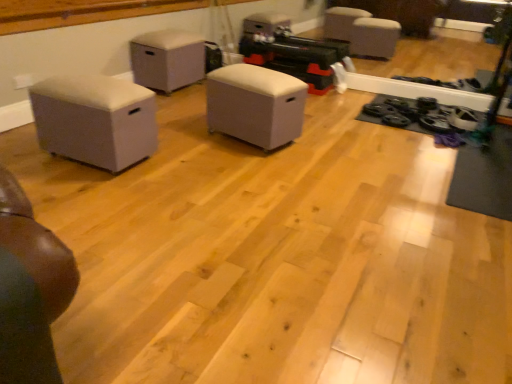
Question: Is beige fabric ottoman at left, acting as the third furniture starting from the back, not inside white fabric ottoman at center, which is the 2th furniture in back-to-front order?

Choices:
 (A) no
 (B) yes

Answer: (B)

Question: Is beige fabric ottoman at left, acting as the third furniture starting from the back, positioned with its back to white fabric ottoman at center, which is the 2th furniture in back-to-front order?

Choices:
 (A) no
 (B) yes

Answer: (A)

Question: Is white fabric ottoman at center, which is the 2th furniture in back-to-front order, completely or partially inside beige fabric ottoman at left, which appears as the first furniture when viewed from the front?

Choices:
 (A) yes
 (B) no

Answer: (B)

Question: Does beige fabric ottoman at left, which appears as the first furniture when viewed from the front, turn towards white fabric ottoman at center, which is the 2th furniture in back-to-front order?

Choices:
 (A) yes
 (B) no

Answer: (B)

Question: From the image's perspective, is beige fabric ottoman at left, acting as the third furniture starting from the back, above white fabric ottoman at center, placed as the 2th furniture when sorted from front to back?

Choices:
 (A) no
 (B) yes

Answer: (A)

Question: From a real-world perspective, is beige fabric ottoman at left, which appears as the first furniture when viewed from the front, physically located above or below white fabric ottoman at center, placed as the 2th furniture when sorted from front to back?

Choices:
 (A) below
 (B) above

Answer: (B)

Question: From their relative heights in the image, would you say beige fabric ottoman at left, acting as the third furniture starting from the back, is taller or shorter than white fabric ottoman at center, which is the 2th furniture in back-to-front order?

Choices:
 (A) tall
 (B) short

Answer: (B)

Question: Based on their sizes in the image, would you say beige fabric ottoman at left, which appears as the first furniture when viewed from the front, is bigger or smaller than white fabric ottoman at center, which is the 2th furniture in back-to-front order?

Choices:
 (A) small
 (B) big

Answer: (A)

Question: Considering the positions of beige fabric ottoman at left, which appears as the first furniture when viewed from the front, and white fabric ottoman at center, placed as the 2th furniture when sorted from front to back, in the image, is beige fabric ottoman at left, which appears as the first furniture when viewed from the front, wider or thinner than white fabric ottoman at center, placed as the 2th furniture when sorted from front to back,?

Choices:
 (A) wide
 (B) thin

Answer: (A)

Question: Considering the positions of beige fabric ottoman at left, acting as the third furniture starting from the back, and matte gray ottoman at center, which is counted as the third furniture, starting from the front, in the image, is beige fabric ottoman at left, acting as the third furniture starting from the back, taller or shorter than matte gray ottoman at center, which is counted as the third furniture, starting from the front,?

Choices:
 (A) short
 (B) tall

Answer: (A)

Question: Is beige fabric ottoman at left, acting as the third furniture starting from the back, wider or thinner than matte gray ottoman at center, which is counted as the third furniture, starting from the front?

Choices:
 (A) wide
 (B) thin

Answer: (A)

Question: Is beige fabric ottoman at left, which appears as the first furniture when viewed from the front, to the left or to the right of matte gray ottoman at center, which is counted as the third furniture, starting from the front, in the image?

Choices:
 (A) right
 (B) left

Answer: (B)

Question: Is beige fabric ottoman at left, which appears as the first furniture when viewed from the front, in front of or behind matte gray ottoman at center, which is counted as the third furniture, starting from the front, in the image?

Choices:
 (A) front
 (B) behind

Answer: (A)

Question: Is point (169, 31) positioned closer to the camera than point (37, 102)?

Choices:
 (A) closer
 (B) farther

Answer: (B)

Question: From the image's perspective, relative to beige fabric ottoman at left, acting as the third furniture starting from the back, is matte gray ottoman at center, which is counted as the third furniture, starting from the front, above or below?

Choices:
 (A) below
 (B) above

Answer: (B)